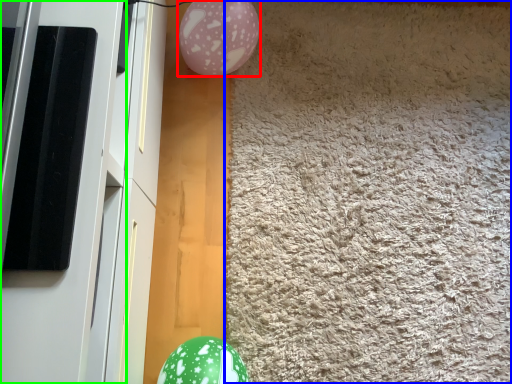
Question: Which is farther away from balloon (highlighted by a red box)? mat (highlighted by a blue box) or screen door (highlighted by a green box)?

Choices:
 (A) mat
 (B) screen door

Answer: (B)